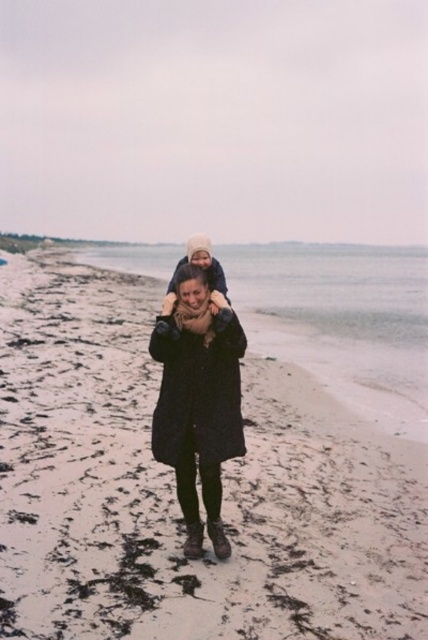
Is the position of white sandy beach at center less distant than that of matte beige hat at upper center?

Yes.

Which is in front, point (136, 312) or point (211, 298)?

Positioned in front is point (211, 298).

Where is `white sandy beach at center`? The image size is (428, 640). white sandy beach at center is located at coordinates (175, 488).

Is point (208, 444) farther from camera compared to point (205, 237)?

No, (208, 444) is in front of (205, 237).

Is matte black coat at center further to the viewer compared to matte beige hat at upper center?

No, it is not.

Which is in front, point (226, 410) or point (190, 257)?

Point (226, 410)

Locate an element on the screen. Image resolution: width=428 pixels, height=640 pixels. matte black coat at center is located at coordinates (198, 401).

Can you confirm if white sandy beach at center is wider than matte black coat at center?

Yes, white sandy beach at center is wider than matte black coat at center.

Describe the element at coordinates (175, 488) in the screenshot. I see `white sandy beach at center` at that location.

Is point (154, 374) behind point (225, 333)?

Yes, it is behind point (225, 333).

Identify the location of white sandy beach at center. [x=175, y=488].